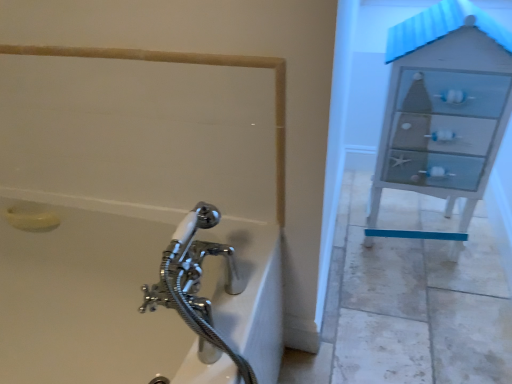
Question: Looking at the image, does beige matte rail at upper left seem bigger or smaller compared to white glossy bathtub at lower left?

Choices:
 (A) big
 (B) small

Answer: (B)

Question: Is beige matte rail at upper left wider or thinner than white glossy bathtub at lower left?

Choices:
 (A) wide
 (B) thin

Answer: (B)

Question: Based on their relative distances, which object is farther from the yellow matte soap at lower left?

Choices:
 (A) beige matte rail at upper left
 (B) white glossy bathtub at lower left
 (C) white glossy file cabinet at right

Answer: (C)

Question: Which object is the closest to the yellow matte soap at lower left?

Choices:
 (A) white glossy bathtub at lower left
 (B) beige matte rail at upper left
 (C) white glossy file cabinet at right

Answer: (A)